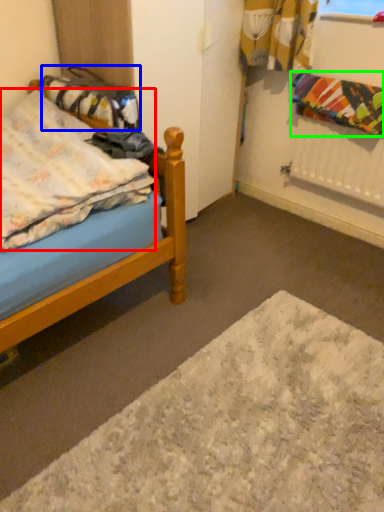
Question: Which object is positioned closest to blanket (highlighted by a red box)? Select from material (highlighted by a blue box) and blanket (highlighted by a green box).

Choices:
 (A) material
 (B) blanket

Answer: (A)